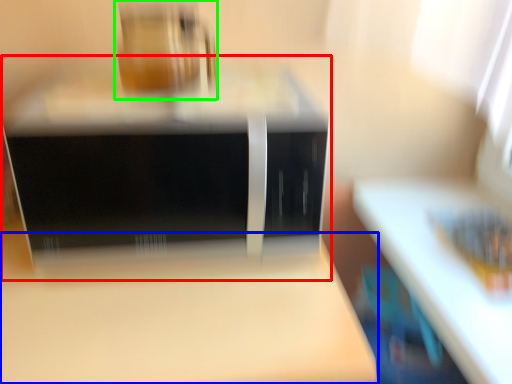
Question: Which object is positioned farthest from home appliance (highlighted by a red box)? Select from table (highlighted by a blue box) and appliance (highlighted by a green box).

Choices:
 (A) table
 (B) appliance

Answer: (A)